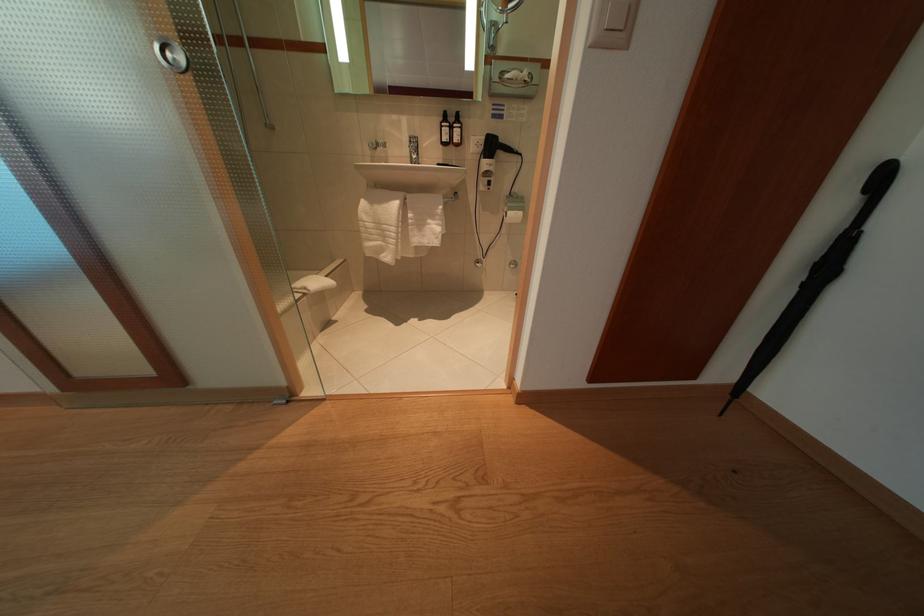
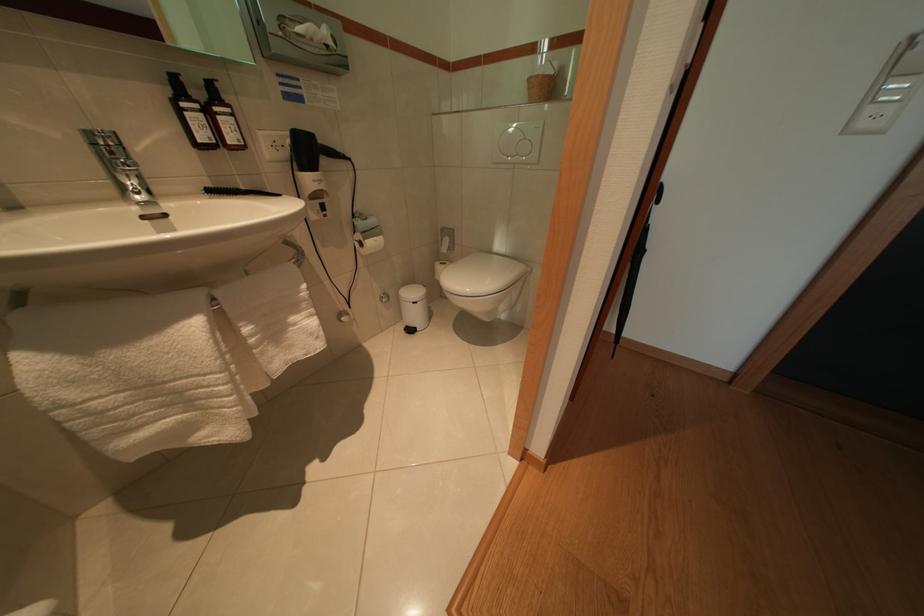
Question: The camera is either moving clockwise (left) or counter-clockwise (right) around the object. The first image is from the beginning of the video and the second image is from the end. Is the camera moving left or right when shooting the video?

Choices:
 (A) Left
 (B) Right

Answer: (A)